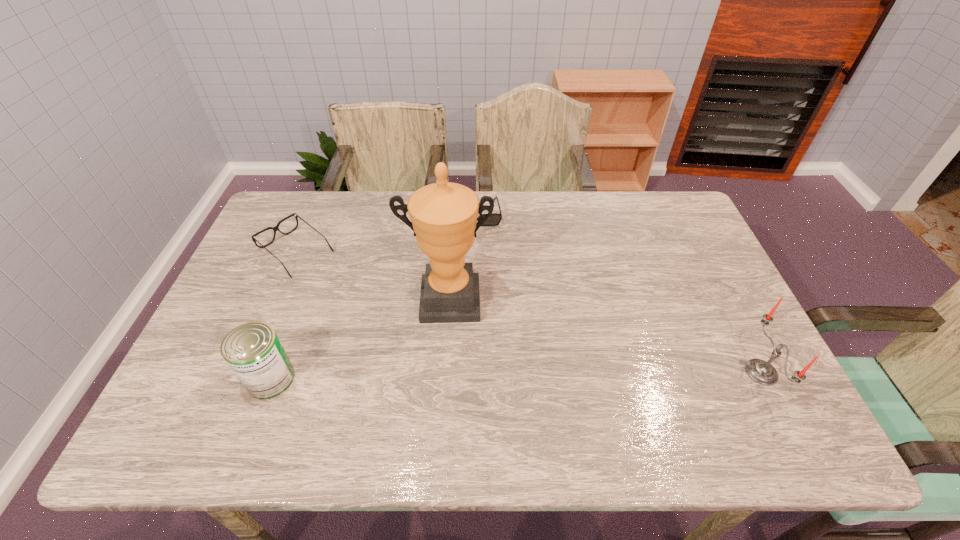
At what (x,y) coordinates should I click in order to perform the action: click on can. Please return your answer as a coordinate pair (x, y). Image resolution: width=960 pixels, height=540 pixels. Looking at the image, I should click on (253, 351).

Where is `the rightmost object`? This screenshot has height=540, width=960. the rightmost object is located at coordinates (762, 372).

The height and width of the screenshot is (540, 960). In order to click on the fourth shortest object in this screenshot , I will do `click(762, 372)`.

I want to click on sunglasses, so click(494, 220).

Identify the location of spectacles. Image resolution: width=960 pixels, height=540 pixels. (276, 228).

Where is `the tallest object`? the tallest object is located at coordinates (443, 215).

The width and height of the screenshot is (960, 540). I want to click on vacant space located 0.340m on the right of the third tallest object, so click(x=438, y=379).

Locate an element on the screen. The height and width of the screenshot is (540, 960). blank space located on the front-facing side of the rightmost object is located at coordinates (692, 372).

Find the location of `vacant area situated on the front-facing side of the rightmost object`. vacant area situated on the front-facing side of the rightmost object is located at coordinates (621, 372).

You are a GUI agent. You are given a task and a screenshot of the screen. Output one action in this format:
    pyautogui.click(x=<x>, y=<y>)
    Task: Click on the free space located on the front-facing side of the rightmost object
    
    Given the screenshot: What is the action you would take?
    pyautogui.click(x=596, y=372)